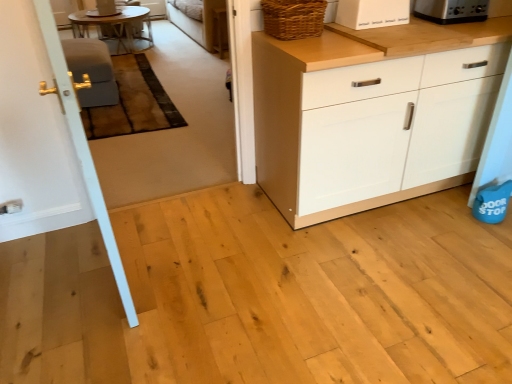
At what (x,y) coordinates should I click in order to perform the action: click on free space in front of white wood cabinet at center. Please return your answer as a coordinate pair (x, y). Image resolution: width=512 pixels, height=384 pixels. Looking at the image, I should click on (394, 272).